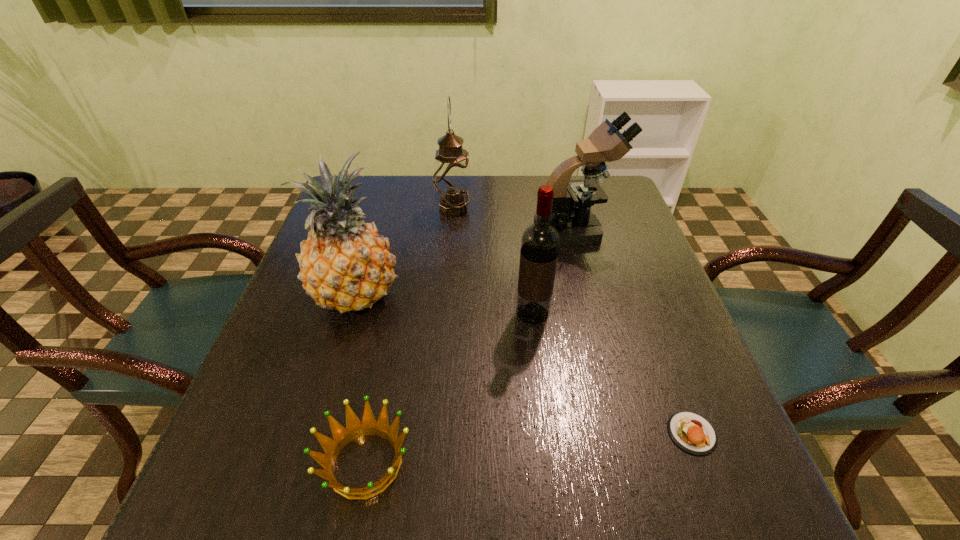
Identify the location of blank space at the near edge. (426, 485).

In order to click on vacant space at the left edge of the desktop in this screenshot , I will do `click(243, 431)`.

Find the location of a particular element. vacant space at the right edge of the desktop is located at coordinates (602, 244).

Identify the location of free point at the far left corner. (389, 186).

This screenshot has height=540, width=960. What are the coordinates of `free region at the near right corner of the desktop` in the screenshot? It's located at (664, 478).

This screenshot has width=960, height=540. I want to click on vacant space that's between the wine bottle and the oil lamp, so click(x=492, y=261).

Where is `free spot between the microscope and the pineapple`? The image size is (960, 540). free spot between the microscope and the pineapple is located at coordinates (466, 263).

Where is `vacant area between the microscope and the crown`? This screenshot has width=960, height=540. vacant area between the microscope and the crown is located at coordinates (470, 347).

Find the location of a particular element. vacant space that's between the crown and the wine bottle is located at coordinates (449, 388).

In order to click on vacant area that lies between the wine bottle and the pineapple in this screenshot , I will do `click(444, 304)`.